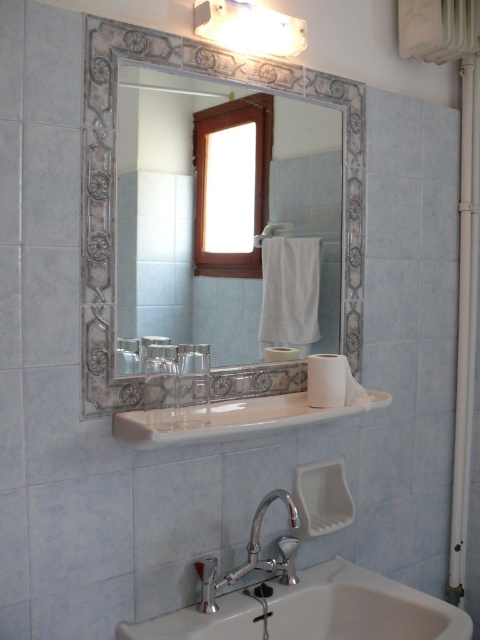
You are designing a bathroom layout and need to ensure that the white ceramic sink at lower center and the polished chrome faucet at lower center will fit on a countertop that can only accommodate one of them. Based on their sizes, which one should you choose?

The white ceramic sink at lower center is bigger than the polished chrome faucet at lower center, so you should choose the polished chrome faucet at lower center to fit on the countertop.

You are designing a layout for a bathroom and need to ensure that the polished chrome faucet at lower center and the white fabric towel bar at center are spaced appropriately. Based on their heights, which one should be placed higher to avoid obstruction?

The polished chrome faucet at lower center is taller than the white fabric towel bar at center, so the faucet should be placed higher to avoid blocking the towel bar.

You are standing in the bathroom and want to place a small plant between the two points marked as point (x=468, y=621) and point (x=278, y=232). According to the image, which point should the plant be closer to in order to be positioned in front of the other point?

The plant should be closer to point (x=468, y=621) because it is in front of point (x=278, y=232).